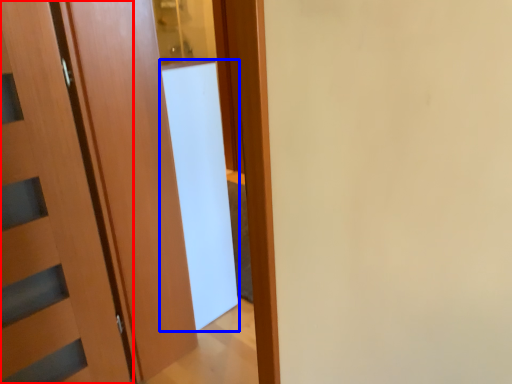
Question: Which point is closer to the camera, door (highlighted by a red box) or screen door (highlighted by a blue box)?

Choices:
 (A) door
 (B) screen door

Answer: (A)